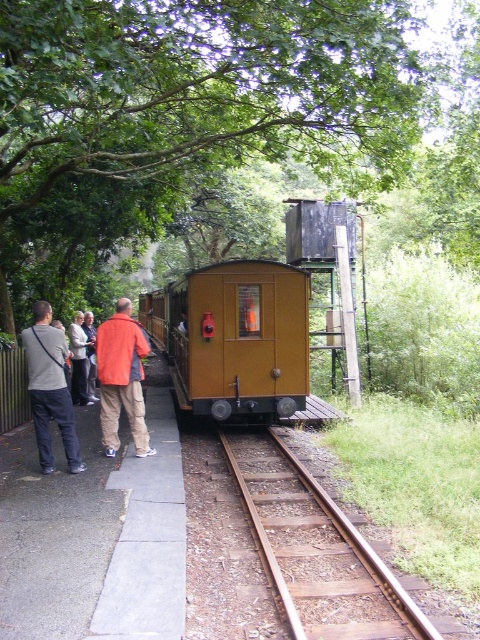
Question: Which point appears farthest from the camera in this image?

Choices:
 (A) (338, 634)
 (B) (254, 333)
 (C) (101, 196)
 (D) (87, 394)

Answer: (C)

Question: Is brown wooden train track at center smaller than orange fabric jacket at left?

Choices:
 (A) no
 (B) yes

Answer: (A)

Question: Can you confirm if matte yellow train at center is thinner than orange jacket at center?

Choices:
 (A) no
 (B) yes

Answer: (A)

Question: Which object is positioned closest to the gray cotton shirt at left?

Choices:
 (A) brown wooden train track at center
 (B) orange shirt at left
 (C) orange fabric jacket at left

Answer: (A)

Question: Considering the real-world distances, which object is farthest from the orange shirt at left?

Choices:
 (A) matte yellow train at center
 (B) orange jacket at center
 (C) green leafy tree at upper center
 (D) gray cotton shirt at left

Answer: (D)

Question: Is gray cotton shirt at left closer to the viewer compared to orange fabric jacket at left?

Choices:
 (A) no
 (B) yes

Answer: (B)